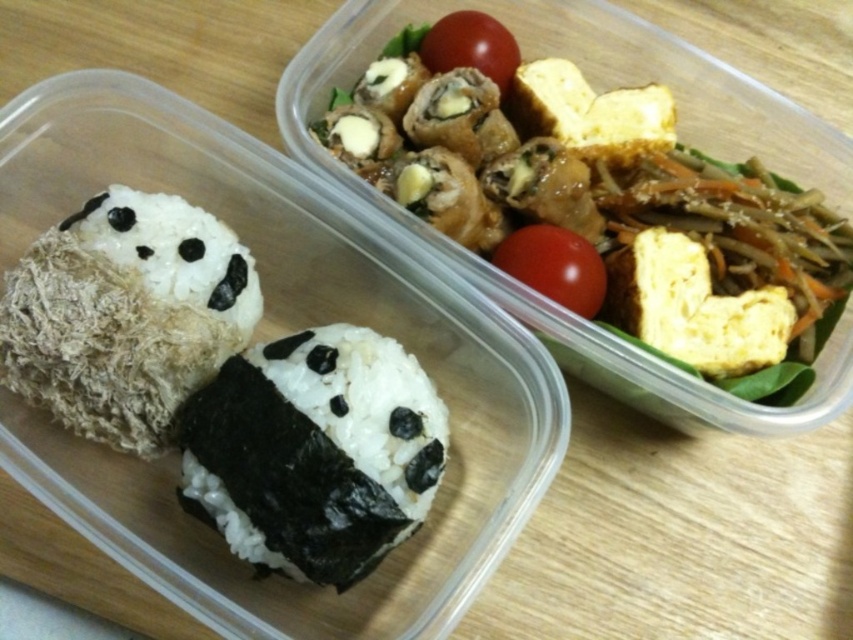
Which of these two, black nori rice ball at center or red matte tomato at center, stands taller?

black nori rice ball at center

Is black nori rice ball at center above red matte tomato at center?

Actually, black nori rice ball at center is below red matte tomato at center.

Between point (364, 465) and point (581, 243), which one is positioned behind?

Positioned behind is point (581, 243).

The width and height of the screenshot is (853, 640). In order to click on black nori rice ball at center in this screenshot , I will do `click(315, 451)`.

Does black nori rice ball at center appear under red matte tomato at upper center?

Indeed, black nori rice ball at center is positioned under red matte tomato at upper center.

Locate an element on the screen. The height and width of the screenshot is (640, 853). black nori rice ball at center is located at coordinates (315, 451).

Does red matte tomato at center have a smaller size compared to red matte tomato at upper center?

Incorrect, red matte tomato at center is not smaller in size than red matte tomato at upper center.

Is red matte tomato at center bigger than red matte tomato at upper center?

Yes, red matte tomato at center is bigger than red matte tomato at upper center.

Which is behind, point (589, 246) or point (503, 74)?

The point (503, 74) is more distant.

Identify the location of red matte tomato at center. (554, 266).